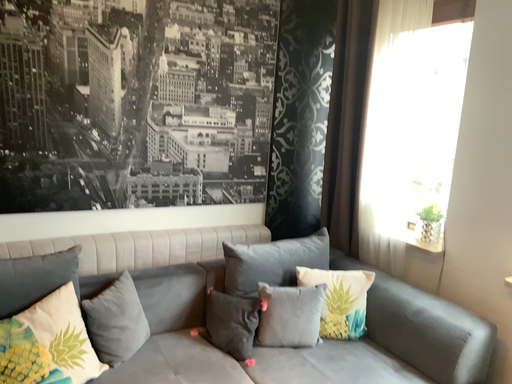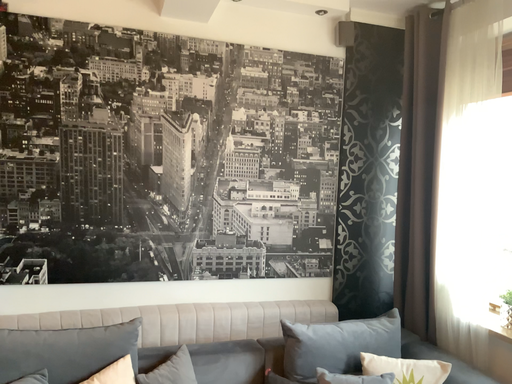
Question: How did the camera likely rotate when shooting the video?

Choices:
 (A) rotated left
 (B) rotated right

Answer: (A)